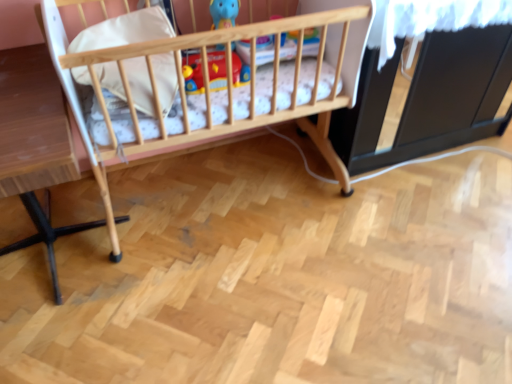
Find the location of `vacant space in light brown wooden table at left (from a real-world perspective)`. vacant space in light brown wooden table at left (from a real-world perspective) is located at coordinates (61, 240).